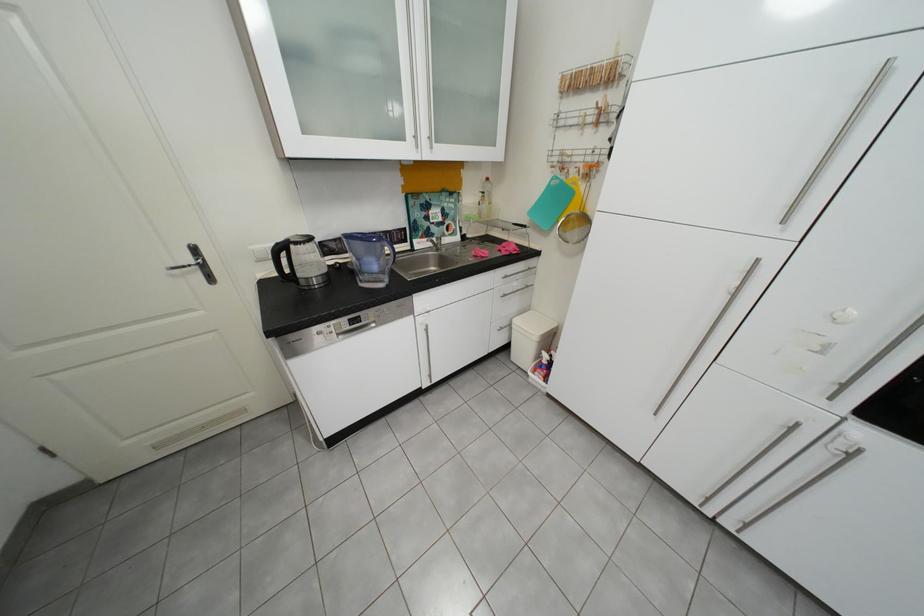
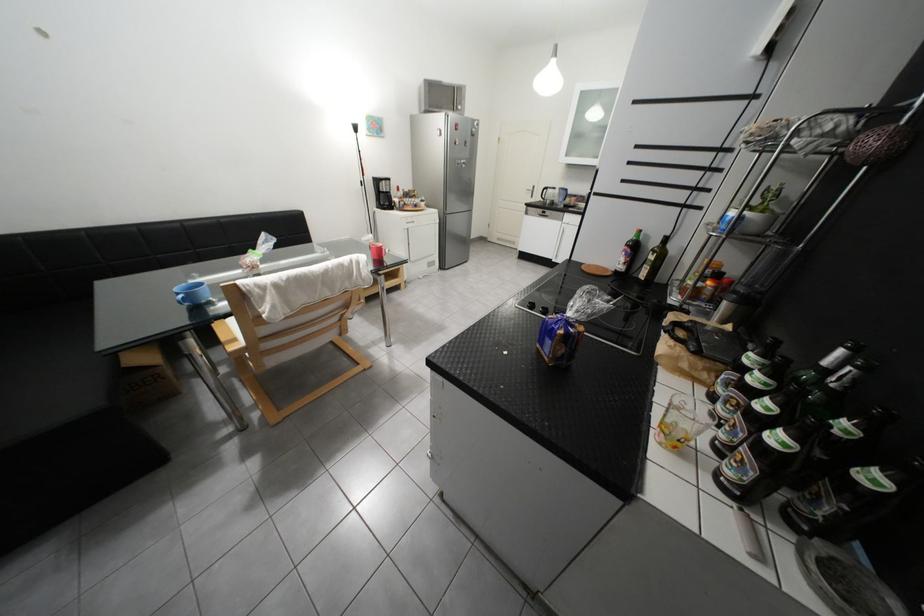
Locate, in the second image, the point that corresponds to (295,248) in the first image.

(557, 190)